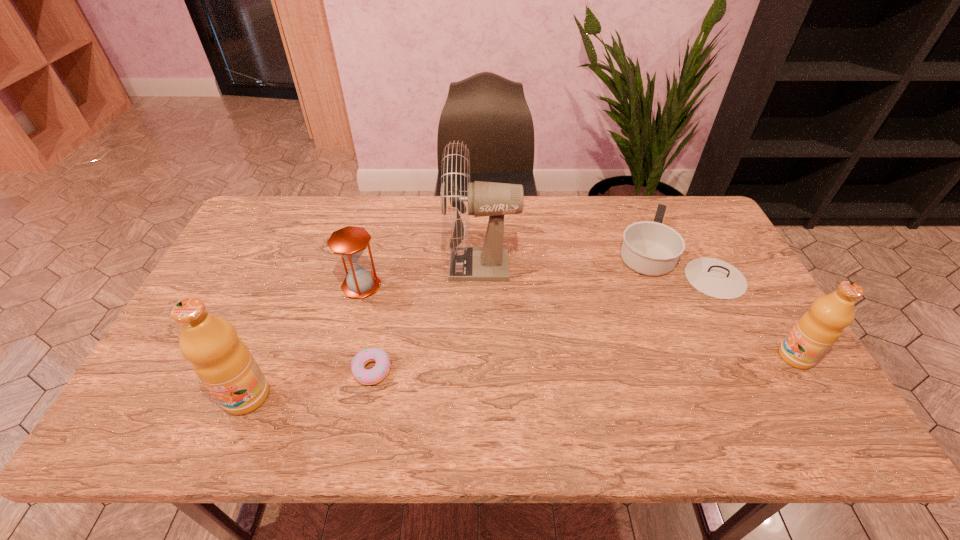
At what (x,y) coordinates should I click in order to perform the action: click on doughnut positioned at the near edge. Please return your answer as a coordinate pair (x, y). Looking at the image, I should click on (381, 369).

Find the location of a particular element. This screenshot has width=960, height=540. fruit juice at the right edge is located at coordinates (816, 331).

Locate an element on the screen. saucepan that is positioned at the right edge is located at coordinates (651, 248).

Find the location of `object that is at the far right corner`. object that is at the far right corner is located at coordinates (651, 248).

Locate an element on the screen. Image resolution: width=960 pixels, height=540 pixels. object that is at the near right corner is located at coordinates (816, 331).

In the image, there is a desktop. Where is `vacant space at the far edge`? This screenshot has height=540, width=960. vacant space at the far edge is located at coordinates (396, 235).

Identify the location of free space at the near edge of the desktop. The width and height of the screenshot is (960, 540). (312, 382).

In the image, there is a desktop. Identify the location of vacant space at the left edge. The image size is (960, 540). (234, 263).

Where is `free space at the right edge`? The width and height of the screenshot is (960, 540). free space at the right edge is located at coordinates (769, 353).

This screenshot has height=540, width=960. I want to click on free space between the shorter fruit juice and the nearer fruit juice, so click(x=521, y=376).